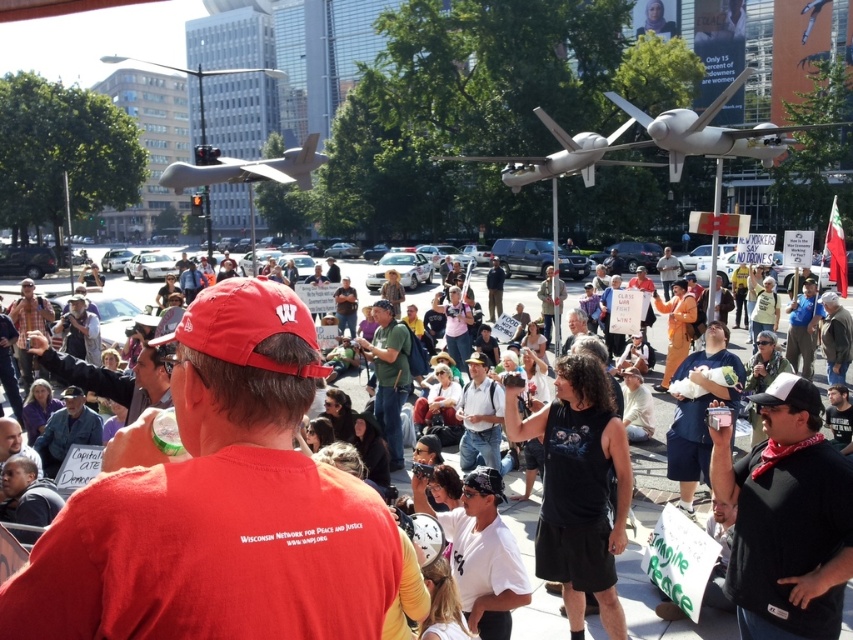
You are a protest organizer who wants to ensure the safety of participants. The police have informed you that any object closer than 100 feet to the crowd could be a safety hazard. Based on the scene, is the matte gray drone at center within the safe distance?

The matte gray drone at center is 86.46 feet away from camera, which is closer than the 100 feet safety distance. Therefore, the drone is within the unsafe zone and poses a safety risk to the participants.

You are a pilot flying a drone that requires a minimum of 50 feet of space to navigate safely between two drones. Given the scene described, can you safely navigate between the white matte drone at upper center and the matte gray drone at center?

The distance between the white matte drone at upper center and the matte gray drone at center is 65.69 feet, which exceeds the required 50 feet of space. Therefore, you can safely navigate between them.